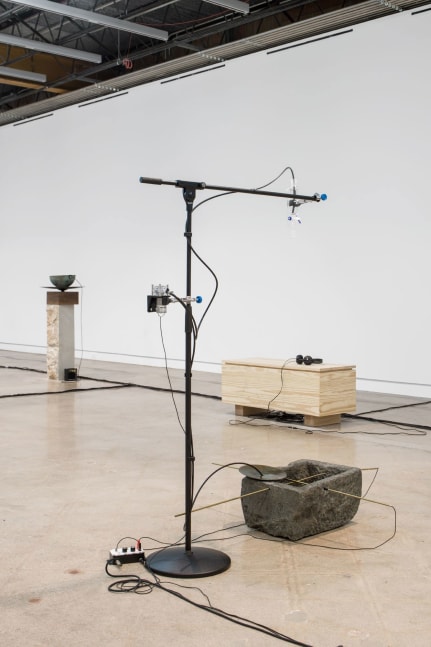
You are a GUI agent. You are given a task and a screenshot of the screen. Output one action in this format:
    pyautogui.click(x=<x>, y=<y>)
    Task: Click on the bench
    This screenshot has height=647, width=431.
    Given the screenshot: What is the action you would take?
    pyautogui.click(x=301, y=393)